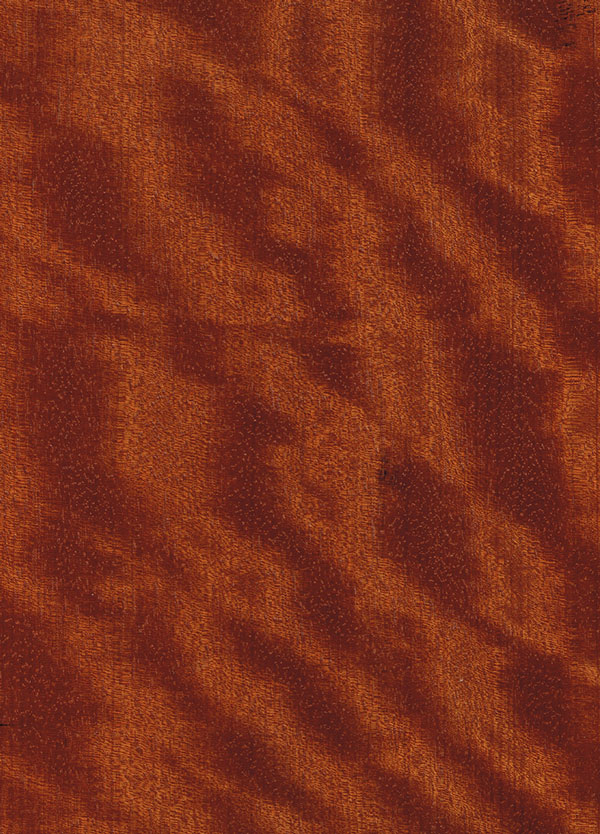
I want to click on empty space right of blanket, so [x=555, y=418].